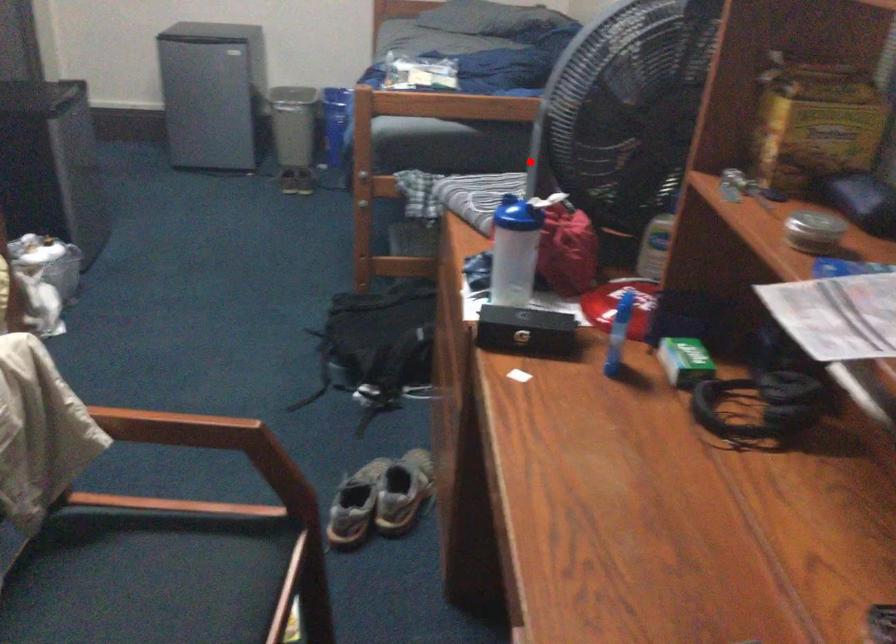
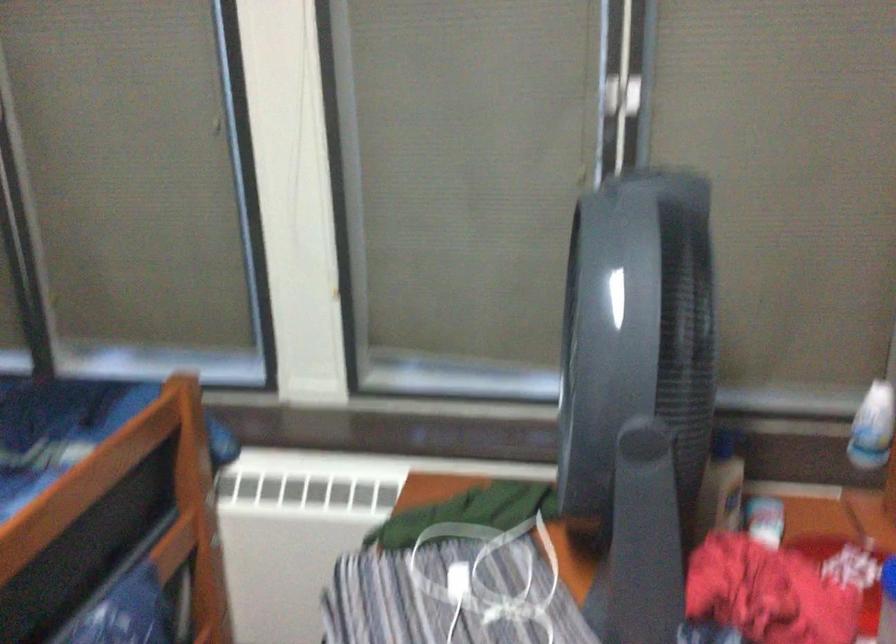
Question: I am providing you with two images of the same scene from different viewpoints. In image1, a red point is highlighted. Considering the same 3D point in image2, which of the following is correct?

Choices:
 (A) It is closer
 (B) It is farther

Answer: (A)